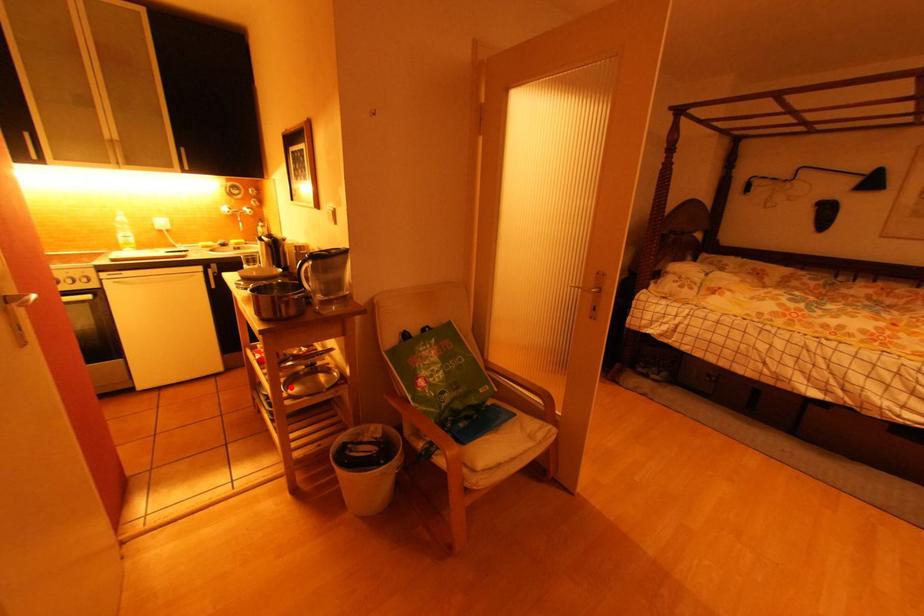
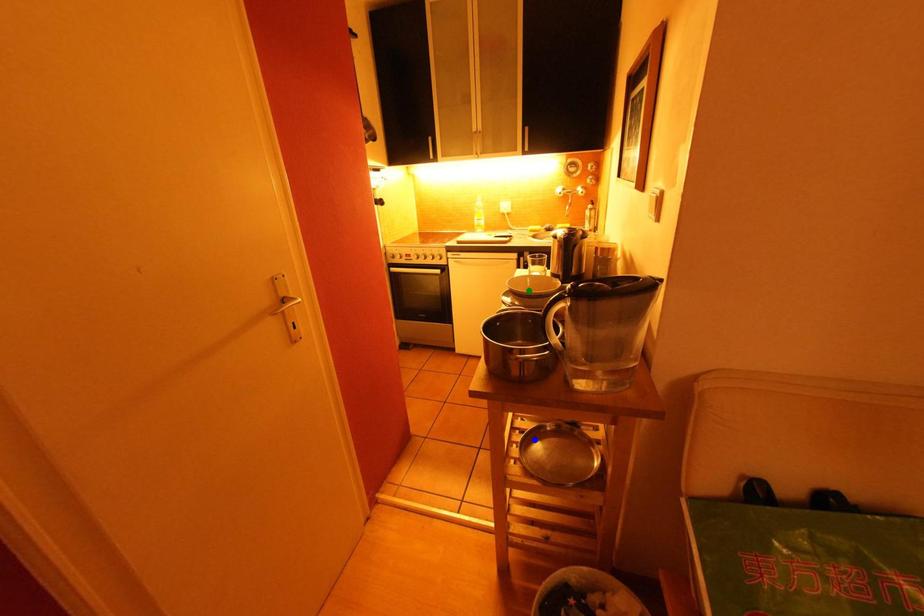
Question: I am providing you with two images of the same scene from different viewpoints. A red point is marked on the first image. You are given multiple points on the second image. Can you choose the point in image 2 that corresponds to the point in image 1?

Choices:
 (A) yellow point
 (B) blue point
 (C) green point

Answer: (B)